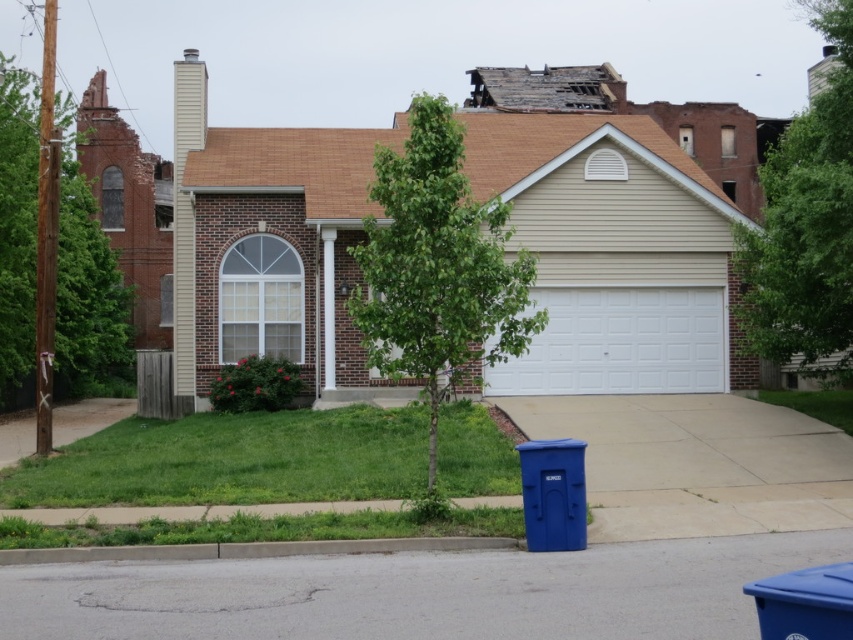
How distant is green leafy tree at center from white textured garage door at center?

green leafy tree at center and white textured garage door at center are 11.24 feet apart.

Between green leafy tree at center and white textured garage door at center, which one appears on the left side from the viewer's perspective?

green leafy tree at center

You are a GUI agent. You are given a task and a screenshot of the screen. Output one action in this format:
    pyautogui.click(x=<x>, y=<y>)
    Task: Click on the green leafy tree at center
    
    Given the screenshot: What is the action you would take?
    pyautogui.click(x=438, y=268)

Does white painted wood garage door at center have a larger size compared to green leafy tree at center?

Correct, white painted wood garage door at center is larger in size than green leafy tree at center.

What do you see at coordinates (610, 253) in the screenshot? I see `white painted wood garage door at center` at bounding box center [610, 253].

Which is behind, point (677, 364) or point (437, 332)?

The point (677, 364) is behind.

This screenshot has width=853, height=640. Find the location of `white painted wood garage door at center`. white painted wood garage door at center is located at coordinates (610, 253).

Who is higher up, green leafy tree at upper right or white textured garage door at center?

green leafy tree at upper right is above.

Measure the distance between green leafy tree at upper right and white textured garage door at center.

11.40 feet

Between point (828, 140) and point (641, 342), which one is positioned behind?

Point (641, 342)

Locate an element on the screen. This screenshot has width=853, height=640. green leafy tree at upper right is located at coordinates (805, 225).